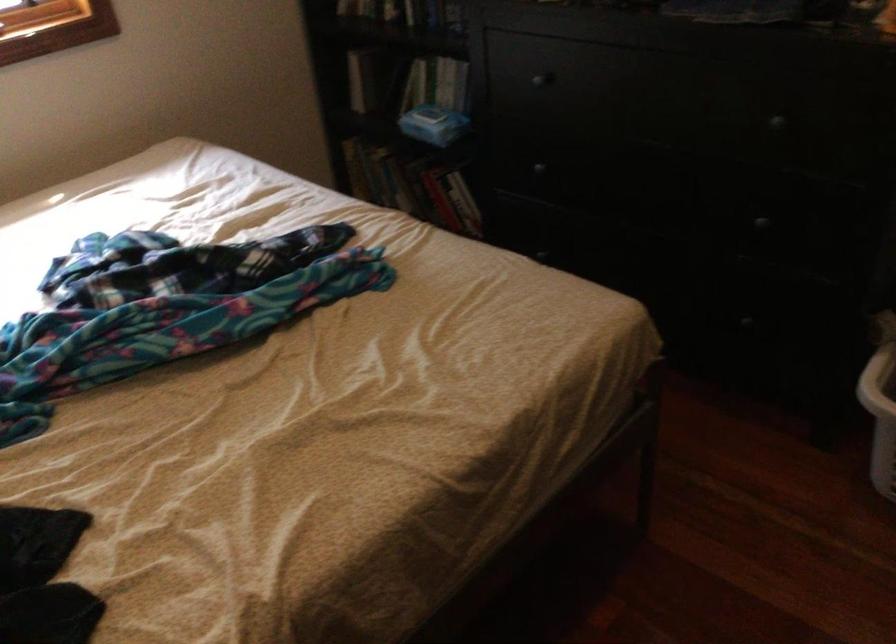
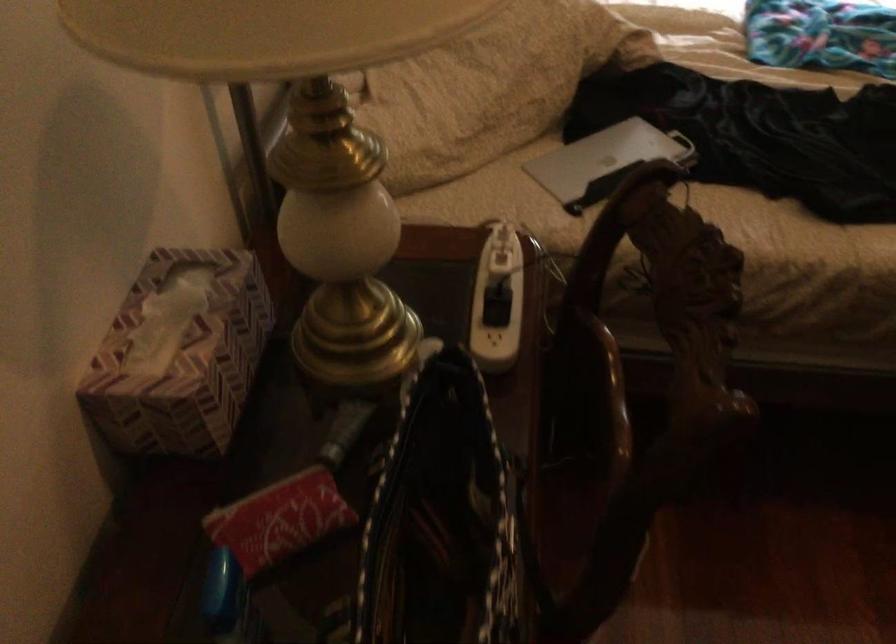
How did the camera likely rotate?

The camera's rotation is toward left-down.